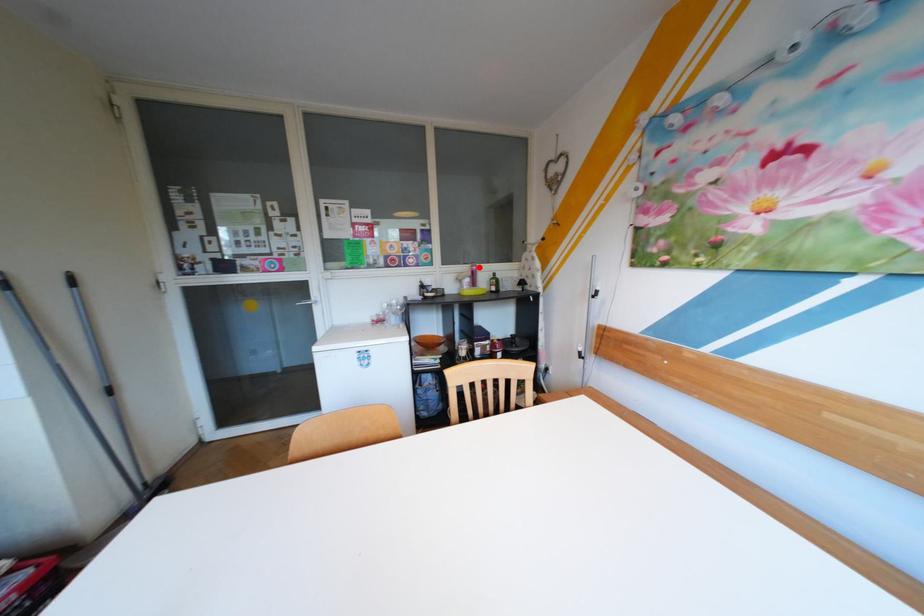
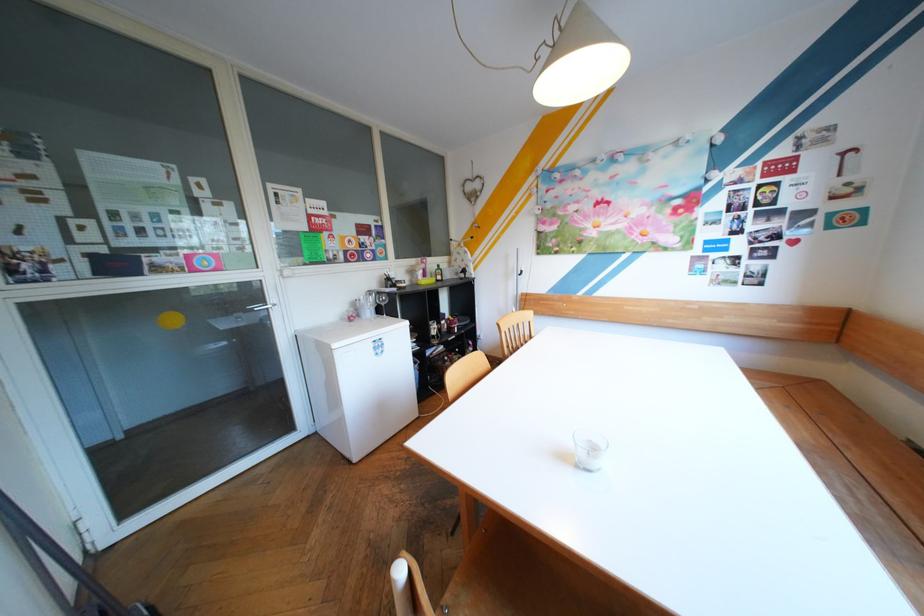
Locate, in the second image, the point that corresponds to the highlighted location in the first image.

(426, 261)